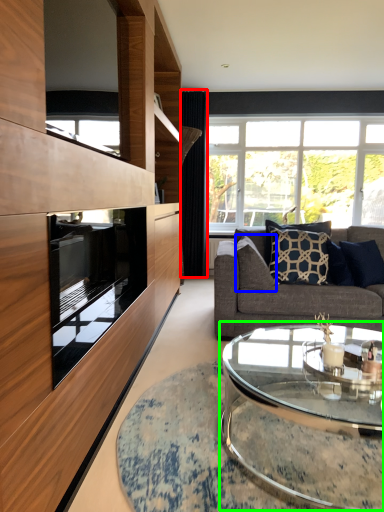
Question: Which object is the closest to the curtain (highlighted by a red box)? Choose among these: pillow (highlighted by a blue box) or coffee table (highlighted by a green box).

Choices:
 (A) pillow
 (B) coffee table

Answer: (A)